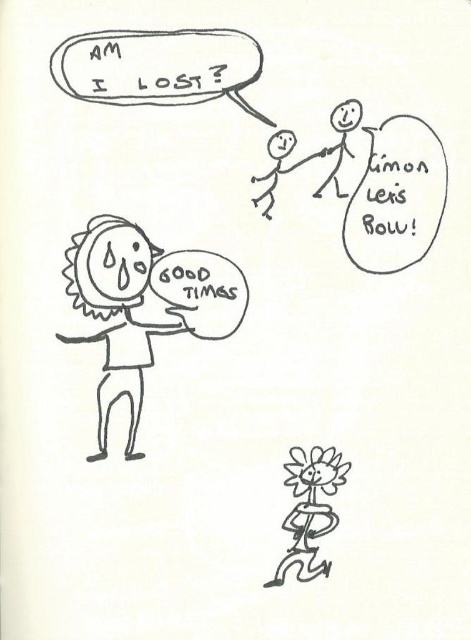
Based on the scene description, what object is located at the coordinates point (116,312)?

The sun shaped face at left is located at point (116,312).